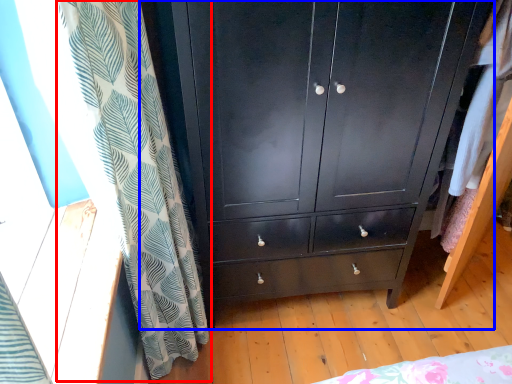
Question: Which of the following is the farthest to the observer, curtain (highlighted by a red box) or chest of drawers (highlighted by a blue box)?

Choices:
 (A) curtain
 (B) chest of drawers

Answer: (B)